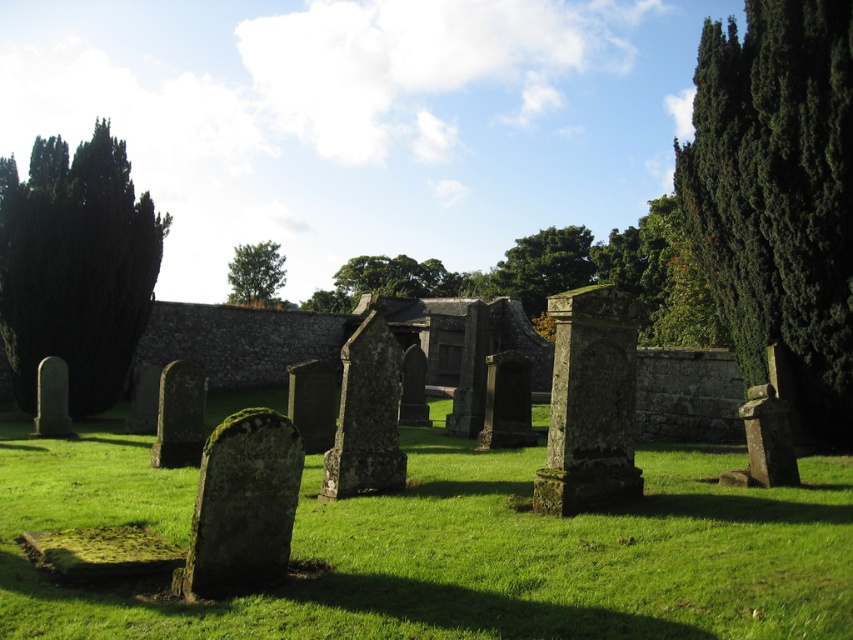
Question: Can you confirm if dark green coniferous tree at left is wider than green leafy tree at upper center?

Choices:
 (A) yes
 (B) no

Answer: (B)

Question: Is dark green coniferous tree at right smaller than green leafy tree at center?

Choices:
 (A) yes
 (B) no

Answer: (A)

Question: Among these objects, which one is farthest from the camera?

Choices:
 (A) green mossy grass at center
 (B) green mossy stone at center
 (C) green leafy tree at upper center
 (D) dark green coniferous tree at left

Answer: (C)

Question: Among these objects, which one is nearest to the camera?

Choices:
 (A) green leafy tree at center
 (B) dark green coniferous tree at right
 (C) green leafy tree at upper center
 (D) green mossy grass at center

Answer: (D)

Question: Among these points, which one is farthest from the camera?

Choices:
 (A) (229, 262)
 (B) (717, 24)
 (C) (494, 284)
 (D) (103, 163)

Answer: (A)

Question: Does green mossy grass at center have a larger size compared to dark green coniferous tree at left?

Choices:
 (A) no
 (B) yes

Answer: (A)